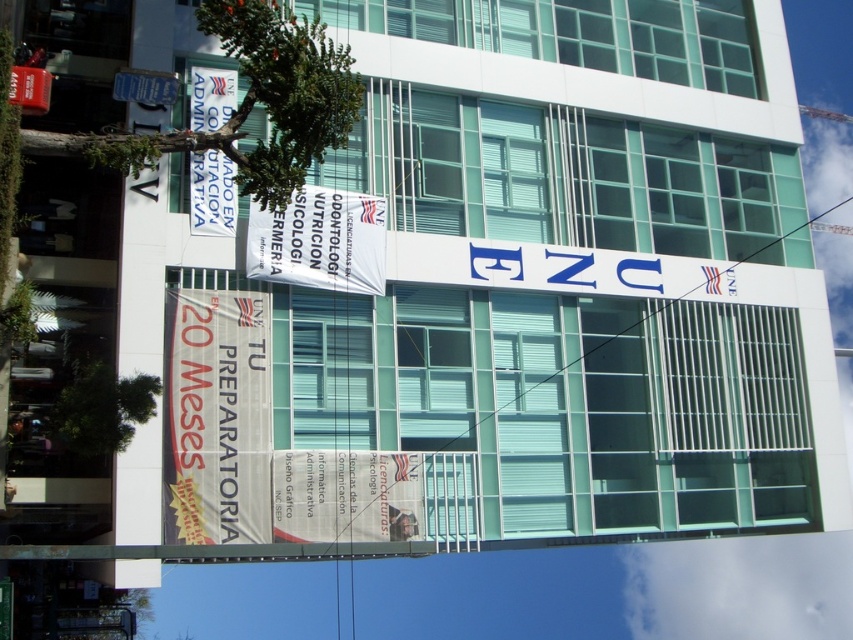
You are standing in front of the modern building and notice two points marked on its facade. The first point is at coordinates point (230, 504) and the second is at point (378, 518). Based on their positions, which point is closer to you?

Point (230, 504) is in front of point (378, 518), so it is closer to you.

You are a visitor approaching the building and want to read both the white paper banner at center and the white paper banner at upper left. Which banner should you look up to see first?

You should look up to see the white paper banner at upper left first because it is positioned higher than the white paper banner at center.

You are a visitor approaching the building and want to read both the white fabric banner at center and the white paper banner at upper left. Which banner should you look at first if you want to read them in the order they appear from left to right?

You should look at the white paper banner at upper left first because it is positioned to the left of the white fabric banner at center, following the left to right order.